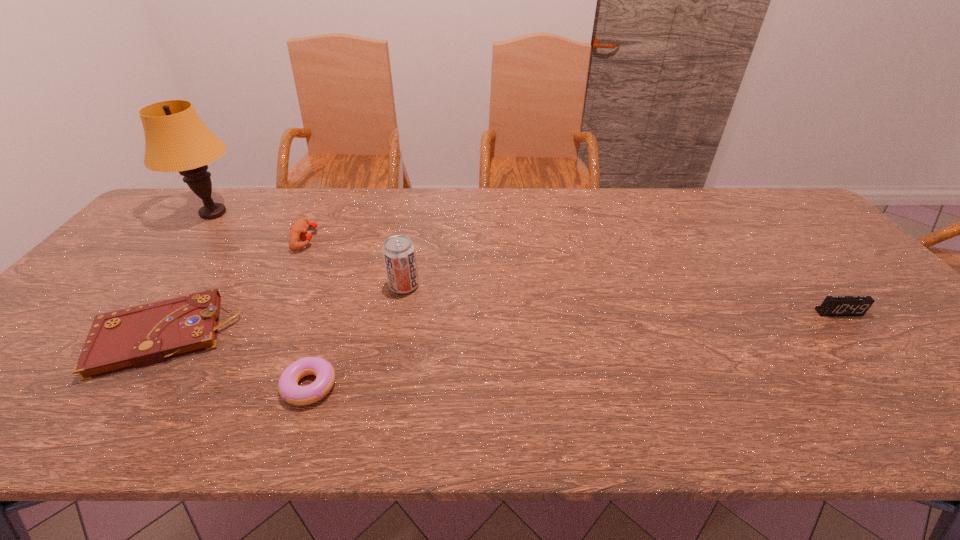
Where is `free region located on the front-facing side of the alarm clock`? The width and height of the screenshot is (960, 540). free region located on the front-facing side of the alarm clock is located at coordinates (857, 335).

At what (x,y) coordinates should I click in order to perform the action: click on vacant space located 0.050m on the front of the notebook. Please return your answer as a coordinate pair (x, y). Looking at the image, I should click on (115, 403).

Locate an element on the screen. The height and width of the screenshot is (540, 960). blank space located on the right of the doughnut is located at coordinates (402, 386).

Where is `lampshade that is at the far edge`? The height and width of the screenshot is (540, 960). lampshade that is at the far edge is located at coordinates (x=176, y=140).

Locate an element on the screen. puncher positioned at the far edge is located at coordinates (298, 231).

This screenshot has height=540, width=960. In order to click on object situated at the near edge in this screenshot , I will do `click(290, 391)`.

Locate an element on the screen. lampshade that is at the left edge is located at coordinates (176, 140).

Find the location of a particular element. notebook located in the left edge section of the desktop is located at coordinates (135, 337).

Where is `object present at the right edge`? object present at the right edge is located at coordinates (832, 305).

The height and width of the screenshot is (540, 960). What are the coordinates of `object at the far left corner` in the screenshot? It's located at (176, 140).